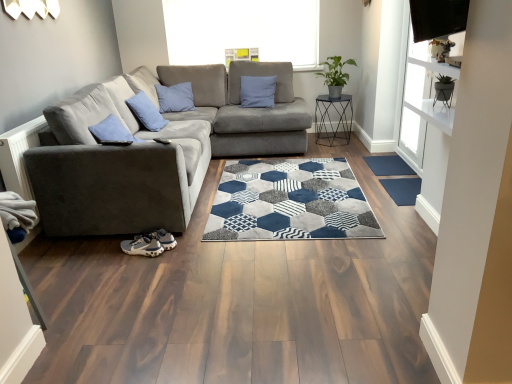
Question: From a real-world perspective, relative to gray suede sneaker at lower left, is dark blue rubber mat at lower right, which ranks as the 2th doormat in front-to-back order, vertically above or below?

Choices:
 (A) below
 (B) above

Answer: (A)

Question: Considering the positions of point (407, 167) and point (126, 244), is point (407, 167) closer or farther from the camera than point (126, 244)?

Choices:
 (A) closer
 (B) farther

Answer: (B)

Question: Based on their relative distances, which object is farther from the transparent glass window screen at upper right?

Choices:
 (A) green matte plant at upper right
 (B) gray fabric couch at left
 (C) metallic black side table at center
 (D) blue fabric pillow at center
 (E) gray suede sneaker at lower left

Answer: (D)

Question: Which object is the farthest from the green matte plant at upper right?

Choices:
 (A) gray fabric couch at left
 (B) dark blue rubber mat at lower right, which ranks as the 2th doormat in front-to-back order
 (C) metallic black side table at center
 (D) transparent glass window screen at upper right
 (E) blue textured mat at right, which appears as the 1th doormat when ordered from the bottom

Answer: (A)